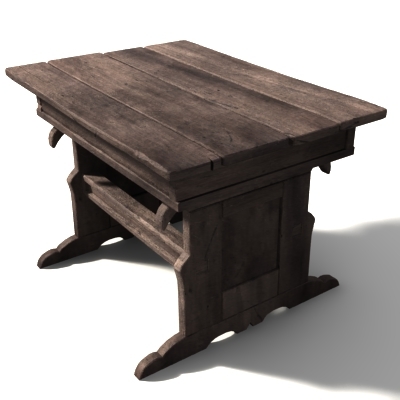
The image size is (400, 400). What are the coordinates of `curved bar coming off table` in the screenshot? It's located at (54, 140), (160, 215), (327, 168).